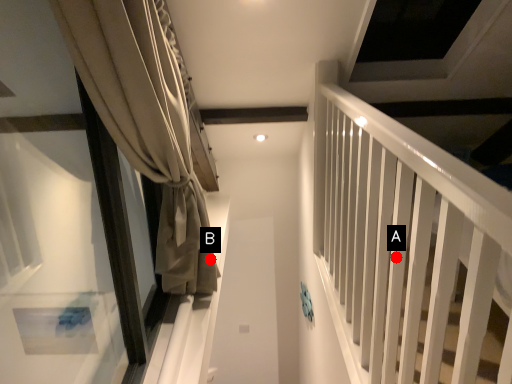
Question: Two points are circled on the image, labeled by A and B beside each circle. Which point appears closest to the camera in this image?

Choices:
 (A) A is closer
 (B) B is closer

Answer: (A)